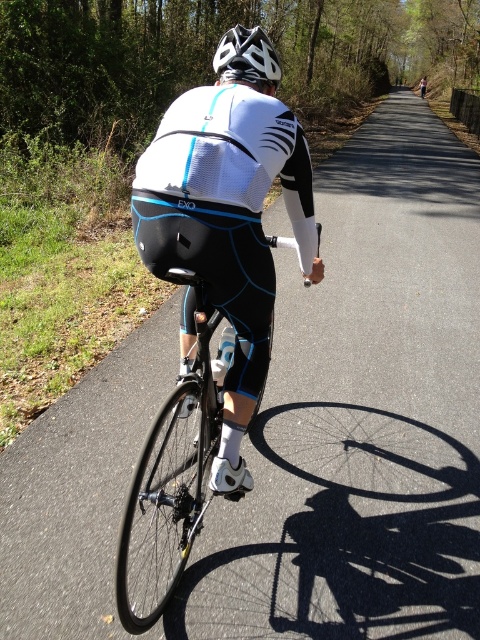
You are a photographer trying to capture the cyclist in the center of your photo. The cyclist is positioned at point (x=169, y=481). Your camera has a focus point at the center of the viewfinder. Will the cyclist be centered in your photo?

The shiny black frame at center is located at point (x=169, y=481), so yes, the cyclist will be centered in your photo.

You are a photographer trying to capture the cyclist in the scene. You notice two objects at the center of the image. Which object would appear bigger in your photo if you focus on the shiny black frame at center and the white matte bicycle helmet at center?

The shiny black frame at center would appear bigger in the photo because it is larger in size than the white matte bicycle helmet at center.